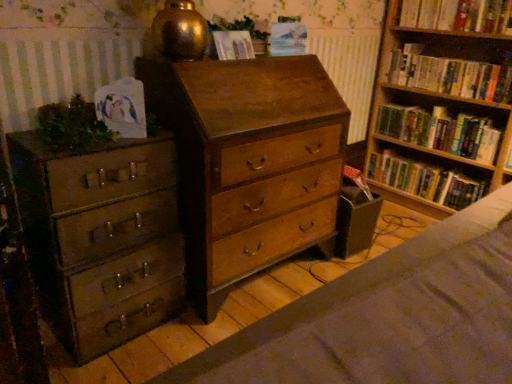
Question: From a real-world perspective, is hardcover books at right, which is the second book in top-to-bottom order, physically below green leafy plant at upper center, the first plant from the top?

Choices:
 (A) yes
 (B) no

Answer: (A)

Question: Is green leafy plant at upper center, which is the second plant from bottom to top, inside hardcover books at right, which is the second book in top-to-bottom order?

Choices:
 (A) no
 (B) yes

Answer: (A)

Question: Is hardcover books at right, marked as the third book in a bottom-to-top arrangement, oriented away from green leafy plant at upper center, which is the second plant from bottom to top?

Choices:
 (A) no
 (B) yes

Answer: (A)

Question: Considering the relative sizes of hardcover books at right, marked as the third book in a bottom-to-top arrangement, and green leafy plant at upper center, marked as the second plant in a front-to-back arrangement, in the image provided, is hardcover books at right, marked as the third book in a bottom-to-top arrangement, wider than green leafy plant at upper center, marked as the second plant in a front-to-back arrangement,?

Choices:
 (A) no
 (B) yes

Answer: (B)

Question: Considering the relative positions of hardcover books at right, which is the second book in top-to-bottom order, and green leafy plant at upper center, the second plant in the left-to-right sequence, in the image provided, is hardcover books at right, which is the second book in top-to-bottom order, behind green leafy plant at upper center, the second plant in the left-to-right sequence,?

Choices:
 (A) no
 (B) yes

Answer: (B)

Question: From the image's perspective, is hardcover books at right, which is the second book in top-to-bottom order, below green leafy plant at upper center, which is the second plant from bottom to top?

Choices:
 (A) yes
 (B) no

Answer: (B)

Question: From a real-world perspective, is matte paper at upper center, marked as the 2th paperback book in a left-to-right arrangement, on hardcover book at upper right, the fourth book in the bottom-to-top sequence?

Choices:
 (A) no
 (B) yes

Answer: (A)

Question: Is matte paper at upper center, which appears as the second paperback book when viewed from the front, thinner than hardcover book at upper right, which ranks as the first book in top-to-bottom order?

Choices:
 (A) yes
 (B) no

Answer: (A)

Question: Is matte paper at upper center, which appears as the second paperback book when viewed from the front, surrounding hardcover book at upper right, the fourth book in the bottom-to-top sequence?

Choices:
 (A) no
 (B) yes

Answer: (A)

Question: From a real-world perspective, is matte paper at upper center, marked as the 2th paperback book in a left-to-right arrangement, below hardcover book at upper right, which ranks as the first book in top-to-bottom order?

Choices:
 (A) yes
 (B) no

Answer: (A)

Question: From the image's perspective, is matte paper at upper center, placed as the 1th paperback book when sorted from back to front, beneath hardcover book at upper right, the fourth book in the bottom-to-top sequence?

Choices:
 (A) no
 (B) yes

Answer: (B)

Question: Does matte paper at upper center, marked as the 2th paperback book in a left-to-right arrangement, have a larger size compared to hardcover book at upper right, the fourth book in the bottom-to-top sequence?

Choices:
 (A) yes
 (B) no

Answer: (B)

Question: Does wooden bookshelf at right, the 2th book in the bottom-to-top sequence, have a greater height compared to green matte plant at left, the second plant in the right-to-left sequence?

Choices:
 (A) yes
 (B) no

Answer: (A)